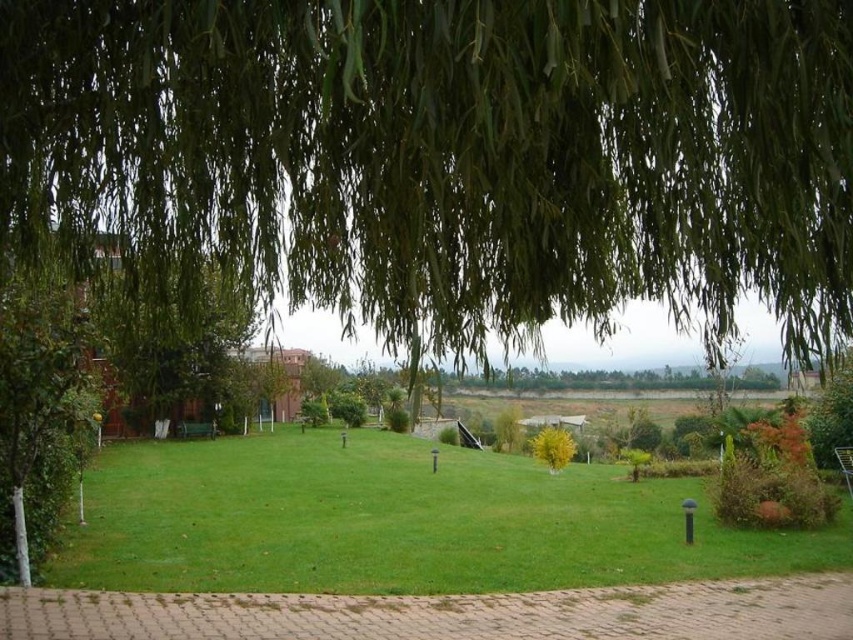
Between green leafy willow at upper center and yellow-green leafy tree at center, which one has less height?

With less height is green leafy willow at upper center.

Looking at this image, between green leafy willow at upper center and yellow-green leafy tree at center, which one is positioned higher?

green leafy willow at upper center

Is point (833, 154) in front of point (569, 436)?

Yes, point (833, 154) is closer to viewer.

Identify the location of green leafy willow at upper center. (450, 154).

Which is above, green grass at center or yellow-green leafy tree at center?

green grass at center is higher up.

This screenshot has width=853, height=640. Identify the location of green grass at center. (398, 522).

Does point (781, 228) lie in front of point (390, 545)?

Yes, point (781, 228) is in front of point (390, 545).

Is green leafy willow at upper center bigger than green grass at center?

Actually, green leafy willow at upper center might be smaller than green grass at center.

Identify the location of green leafy willow at upper center. The width and height of the screenshot is (853, 640). (450, 154).

I want to click on green leafy willow at upper center, so click(x=450, y=154).